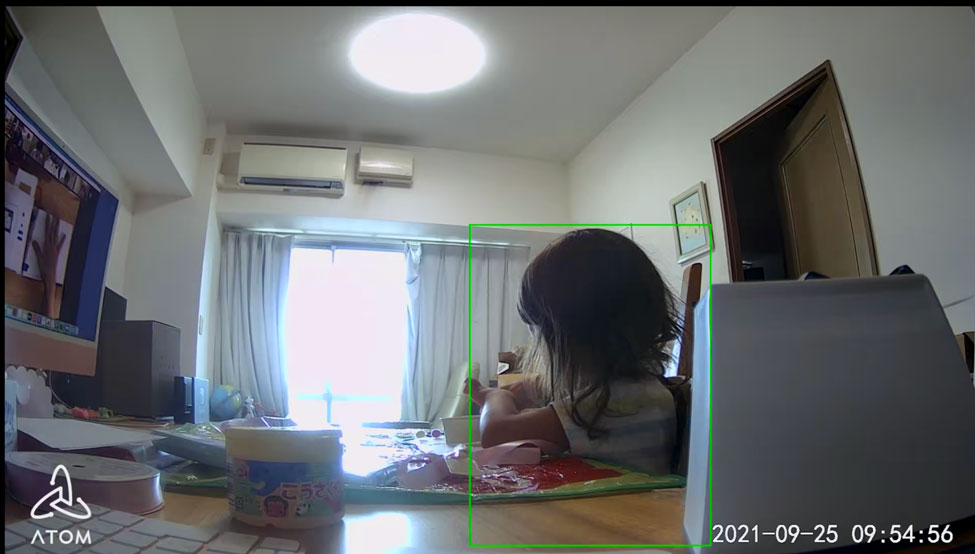
Image resolution: width=975 pixels, height=554 pixels. In order to click on white curtains in this screenshot , I will do `click(441, 284)`, `click(444, 378)`, `click(241, 328)`.